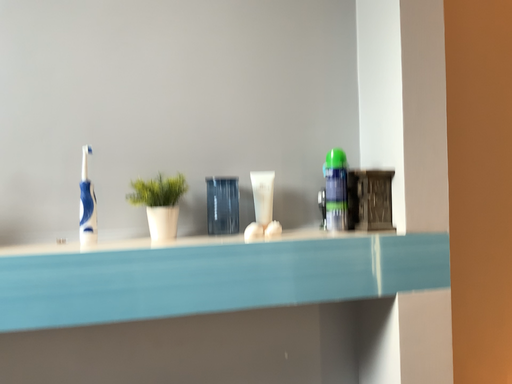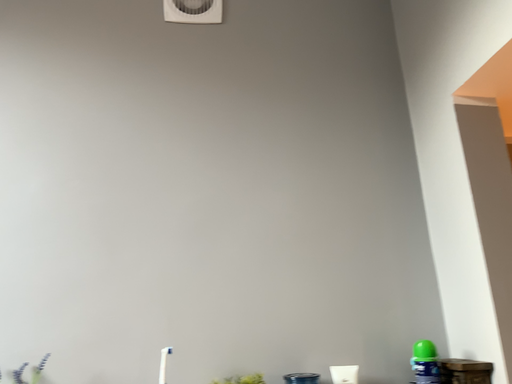
Question: Which way did the camera rotate in the video?

Choices:
 (A) rotated right
 (B) rotated left

Answer: (B)